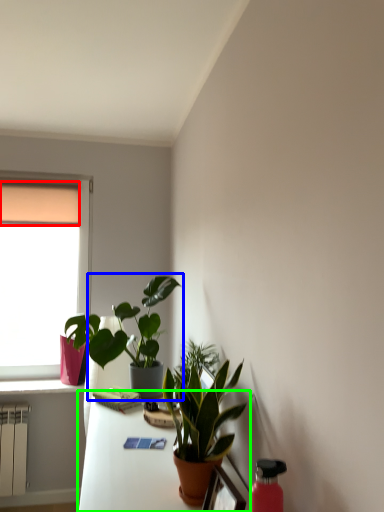
Question: Estimate the real-world distances between objects in this image. Which object is farther from curtain (highlighted by a red box), houseplant (highlighted by a blue box) or table (highlighted by a green box)?

Choices:
 (A) houseplant
 (B) table

Answer: (B)